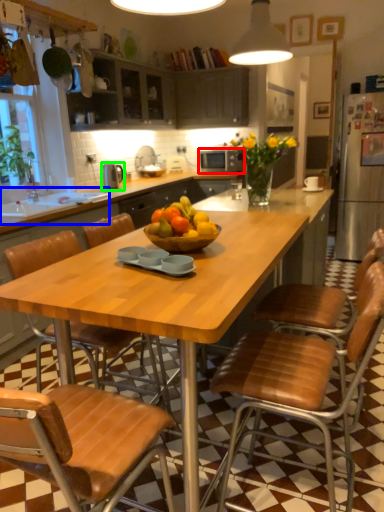
Question: Estimate the real-world distances between objects in this image. Which object is farther from kitchen appliance (highlighted by a red box), sink (highlighted by a blue box) or appliance (highlighted by a green box)?

Choices:
 (A) sink
 (B) appliance

Answer: (A)